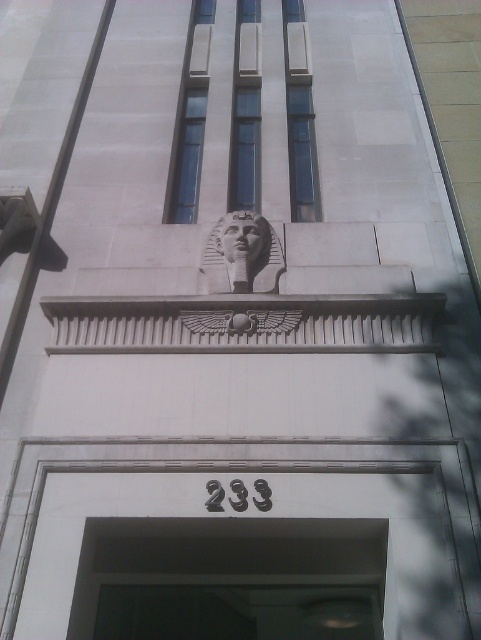
Based on the photo, you are standing in front of the building and want to enter through the door. Can you see the white stone pharaoh head at center from the black glass door at center?

Yes, the black glass door at center is positioned under the white stone pharaoh head at center, so the pharaoh head is above the door and visible from it.

You are an architect examining the building facade. You notice two points marked on the image at coordinates point [119,552] and point [250,268]. Which point is nearer to your current viewpoint?

Point [119,552] is closer to the camera than point [250,268].

You are an architect designing a new building inspired by ancient Egyptian architecture. You want to ensure that the entranceway maintains the same proportional relationship between the black glass door at center and the white stone pharaoh head at center as seen in the reference image. If the pharaoh head is to be 2 meters tall, how tall should the door be?

The black glass door at center is much taller than the white stone pharaoh head at center. Therefore, if the pharaoh head is 2 meters tall, the door should be significantly taller, such as 3 meters, to maintain the proportional relationship.